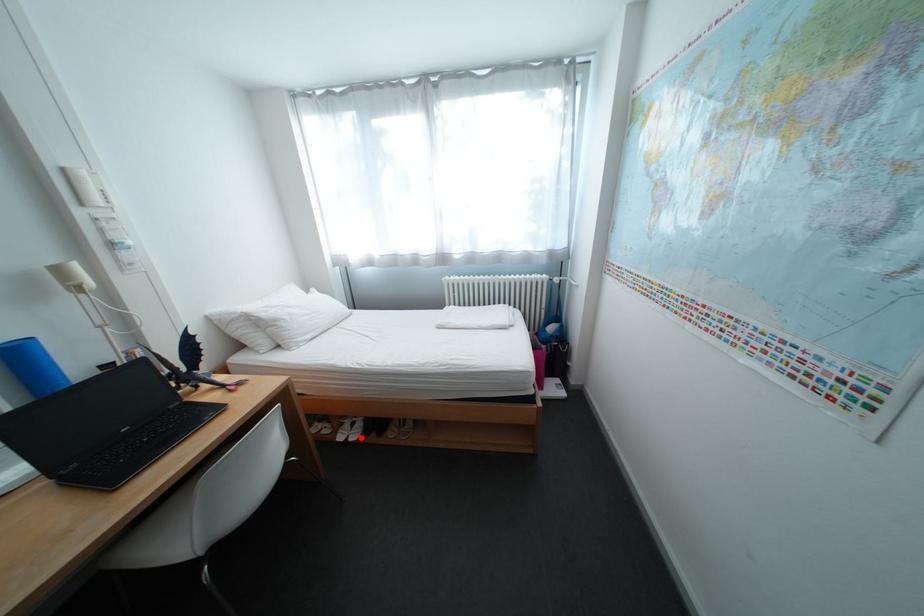
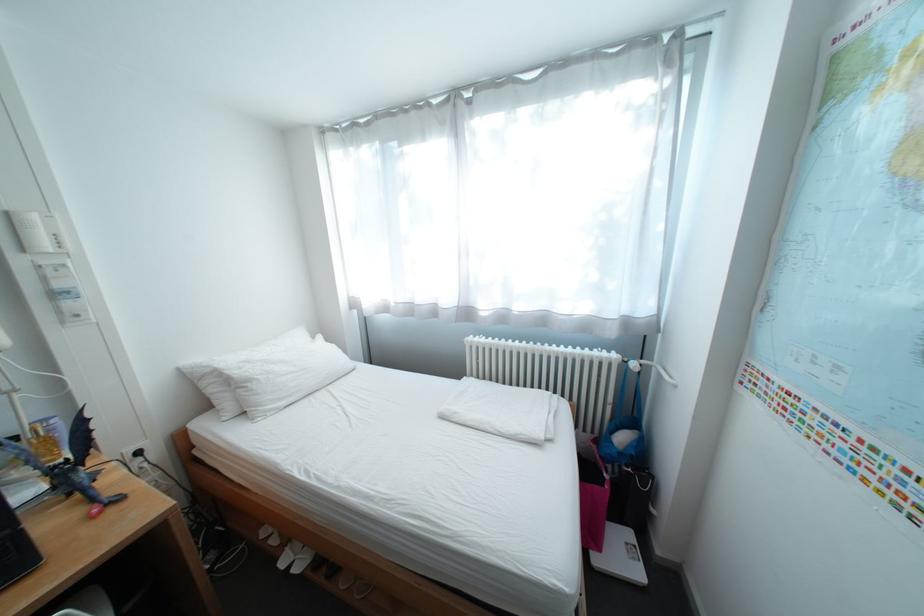
Question: I am providing you with two images of the same scene from different viewpoints. Image1 has a red point marked. In image2, the corresponding 3D location appears at what relative position? Reply with the corresponding letter.

Choices:
 (A) Closer
 (B) Farther

Answer: (A)